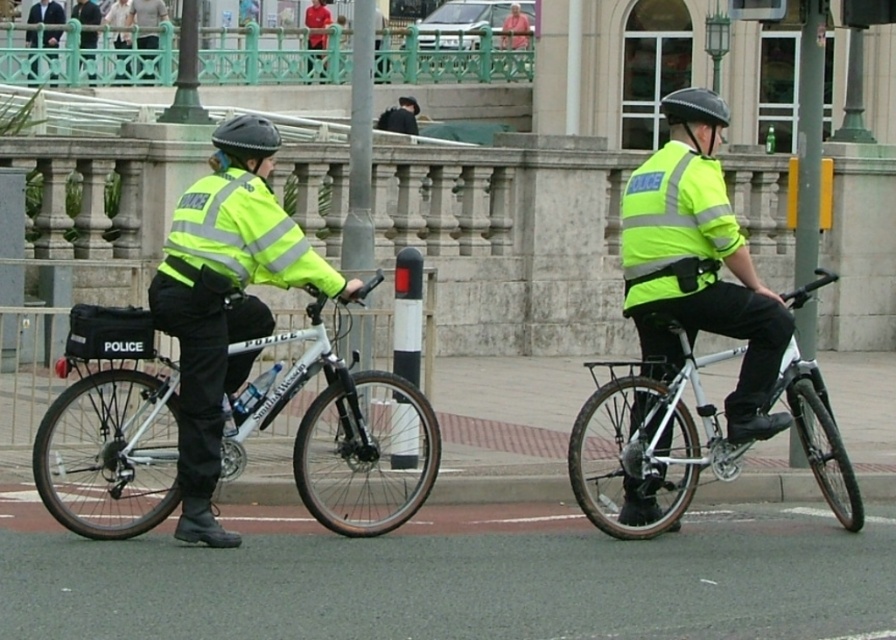
Question: Which point is farther from the camera taking this photo?

Choices:
 (A) (616, 531)
 (B) (688, 205)
 (C) (673, 113)

Answer: (C)

Question: Is high visibility reflective jacket at center to the right of high visibility yellow reflective vest at center from the viewer's perspective?

Choices:
 (A) no
 (B) yes

Answer: (A)

Question: Can you confirm if white metallic bicycle at left is positioned to the left of silver metallic bicycle at center?

Choices:
 (A) no
 (B) yes

Answer: (B)

Question: Can you confirm if high visibility reflective jacket at center is positioned above matte black helmet at center?

Choices:
 (A) no
 (B) yes

Answer: (A)

Question: Which point is farther to the camera?

Choices:
 (A) green textured railing at upper center
 (B) matte black helmet at left
 (C) matte black helmet at center

Answer: (A)

Question: Which object appears closest to the camera in this image?

Choices:
 (A) matte black helmet at left
 (B) white metallic bicycle at left
 (C) dark blue suit at upper left
 (D) silver metallic bicycle at center

Answer: (B)